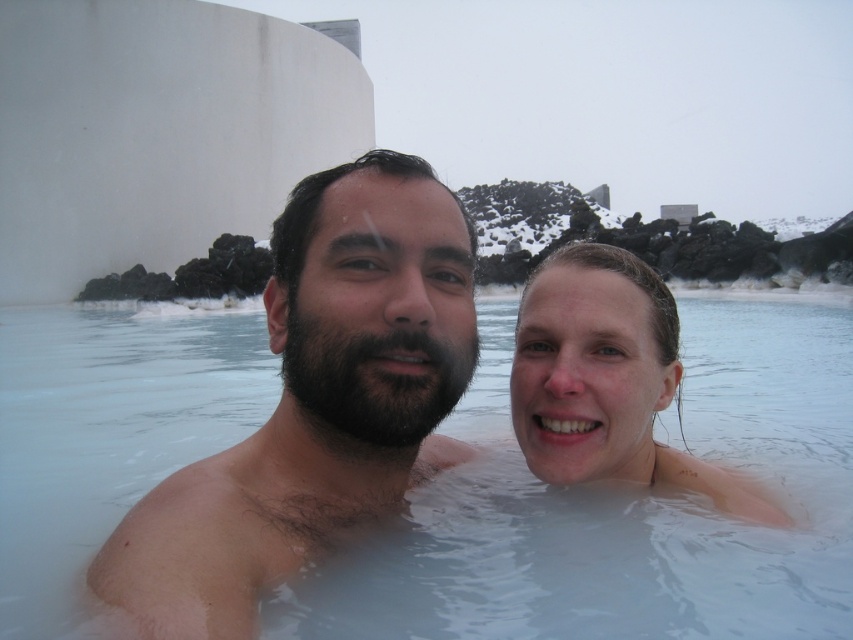
Question: Estimate the real-world distances between objects in this image. Which object is farther from the smooth skin man at center?

Choices:
 (A) clear water at center
 (B) smooth skin face at center

Answer: (A)

Question: Based on their relative distances, which object is nearer to the smooth skin face at center?

Choices:
 (A) clear water at center
 (B) smooth skin man at center

Answer: (B)

Question: Is the position of smooth skin man at center more distant than that of smooth skin face at center?

Choices:
 (A) no
 (B) yes

Answer: (A)

Question: Can you confirm if clear water at center is positioned to the right of smooth skin face at center?

Choices:
 (A) yes
 (B) no

Answer: (B)

Question: Which point is farther to the camera?

Choices:
 (A) (641, 444)
 (B) (216, 499)

Answer: (A)

Question: Does clear water at center come in front of smooth skin face at center?

Choices:
 (A) yes
 (B) no

Answer: (A)